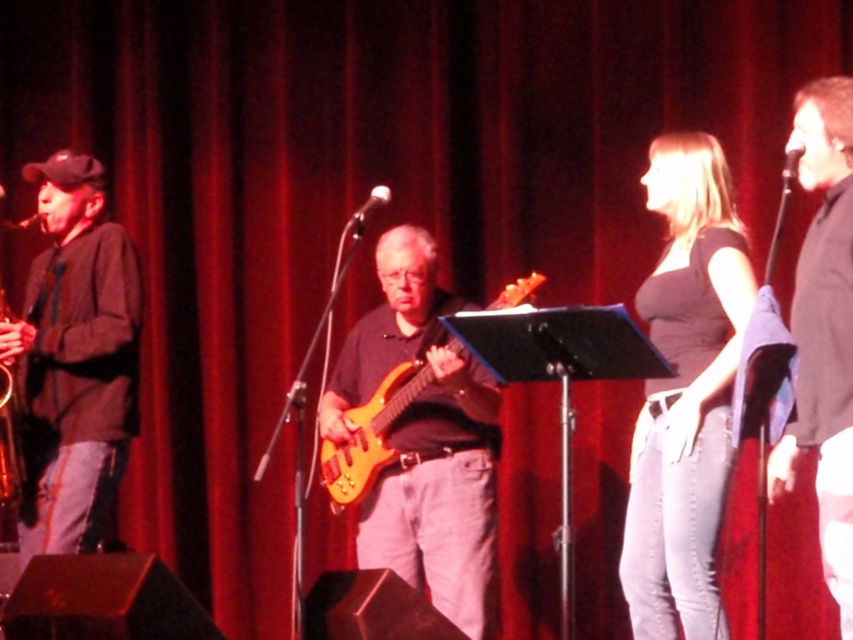
You are a stagehand who needs to adjust the spotlight to the matte black top at center. According to the stage coordinates, where exactly should you direct the spotlight?

The matte black top at center is located at point (685, 392), so you should direct the spotlight to that coordinate.

You are standing at the camera position and want to toss a small ball to the point marked at coordinates point (830, 392). What is the minimum distance you need to throw the ball to reach that point?

The minimum distance you need to throw the ball to reach the point marked at coordinates point (830, 392) is 2.91 meters.